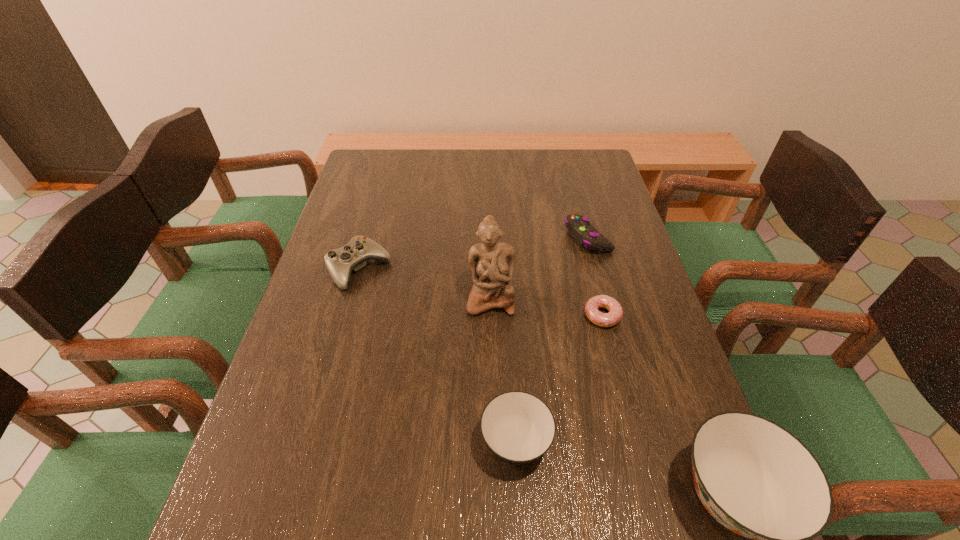
Where is `the left soup bowl`? This screenshot has width=960, height=540. the left soup bowl is located at coordinates (518, 427).

I want to click on figurine, so click(x=492, y=263).

I want to click on the shortest object, so click(x=615, y=314).

What are the coordinates of `the shorter control` in the screenshot? It's located at (579, 227).

At what (x,y) coordinates should I click in order to perform the action: click on the right control. Please return your answer as a coordinate pair (x, y). The height and width of the screenshot is (540, 960). Looking at the image, I should click on (579, 227).

Image resolution: width=960 pixels, height=540 pixels. Find the location of `the leftmost object`. the leftmost object is located at coordinates (340, 262).

The height and width of the screenshot is (540, 960). Identify the location of vacant position located on the back of the shorter soup bowl. (508, 318).

What are the coordinates of `free region located 0.250m on the front-facing side of the figurine` in the screenshot? It's located at (492, 410).

Where is `vacant space located on the front of the doughnut`? This screenshot has height=540, width=960. vacant space located on the front of the doughnut is located at coordinates (612, 352).

Where is `vacant point located 0.070m on the front of the right control`? vacant point located 0.070m on the front of the right control is located at coordinates (597, 273).